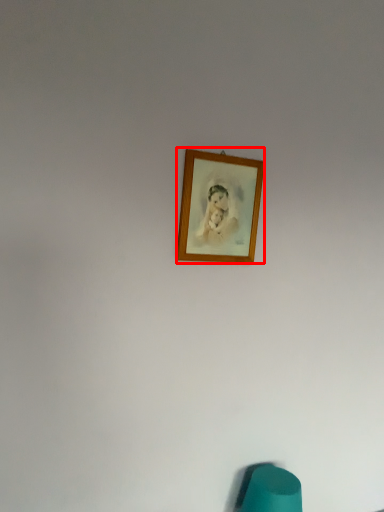
Question: From the image's perspective, what is the correct spatial relationship of picture frame (annotated by the red box) in relation to bean bag chair?

Choices:
 (A) below
 (B) above

Answer: (B)